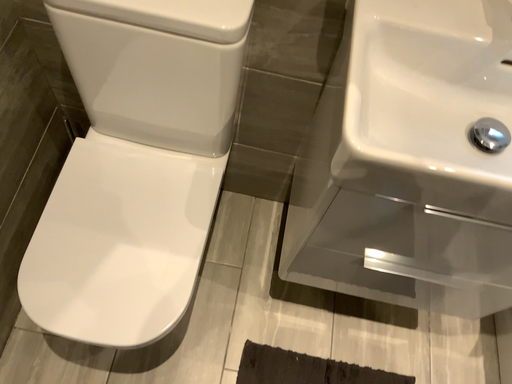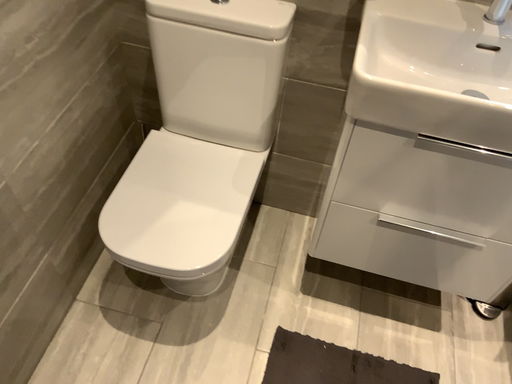
Question: How did the camera likely rotate when shooting the video?

Choices:
 (A) rotated upward
 (B) rotated downward

Answer: (A)